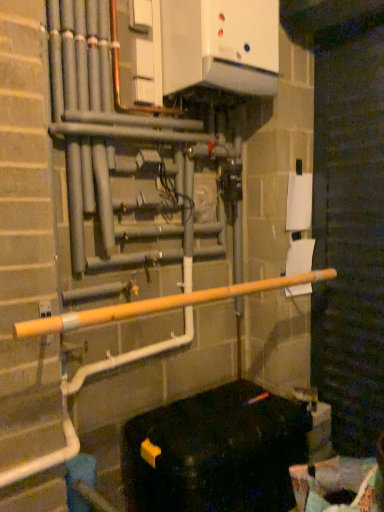
Question: Considering the relative positions of recycled cardboard box at lower right and black plastic container at lower right in the image provided, is recycled cardboard box at lower right in front of black plastic container at lower right?

Choices:
 (A) yes
 (B) no

Answer: (A)

Question: Is recycled cardboard box at lower right outside black plastic container at lower right?

Choices:
 (A) no
 (B) yes

Answer: (B)

Question: From the image's perspective, is recycled cardboard box at lower right on top of black plastic container at lower right?

Choices:
 (A) yes
 (B) no

Answer: (B)

Question: Considering the relative sizes of recycled cardboard box at lower right and black plastic container at lower right in the image provided, is recycled cardboard box at lower right bigger than black plastic container at lower right?

Choices:
 (A) yes
 (B) no

Answer: (B)

Question: Is recycled cardboard box at lower right thinner than black plastic container at lower right?

Choices:
 (A) no
 (B) yes

Answer: (B)

Question: Considering their positions, is black plastic container at lower right located in front of or behind yellow matte pipe at center?

Choices:
 (A) behind
 (B) front

Answer: (A)

Question: From a real-world perspective, is black plastic container at lower right above or below yellow matte pipe at center?

Choices:
 (A) above
 (B) below

Answer: (B)

Question: Does point (225, 506) appear closer or farther from the camera than point (317, 272)?

Choices:
 (A) farther
 (B) closer

Answer: (B)

Question: Considering the relative positions of black plastic container at lower right and yellow matte pipe at center in the image provided, is black plastic container at lower right to the left or to the right of yellow matte pipe at center?

Choices:
 (A) left
 (B) right

Answer: (B)

Question: Relative to black plastic container at lower right, is yellow matte pipe at center in front or behind?

Choices:
 (A) behind
 (B) front

Answer: (B)

Question: From a real-world perspective, is yellow matte pipe at center positioned above or below black plastic container at lower right?

Choices:
 (A) above
 (B) below

Answer: (A)

Question: Do you think yellow matte pipe at center is within black plastic container at lower right, or outside of it?

Choices:
 (A) outside
 (B) inside

Answer: (A)

Question: Is yellow matte pipe at center wider or thinner than black plastic container at lower right?

Choices:
 (A) thin
 (B) wide

Answer: (A)

Question: Choose the correct answer: Is black plastic container at lower right inside recycled cardboard box at lower right or outside it?

Choices:
 (A) outside
 (B) inside

Answer: (A)

Question: Considering the positions of black plastic container at lower right and recycled cardboard box at lower right in the image, is black plastic container at lower right wider or thinner than recycled cardboard box at lower right?

Choices:
 (A) wide
 (B) thin

Answer: (A)